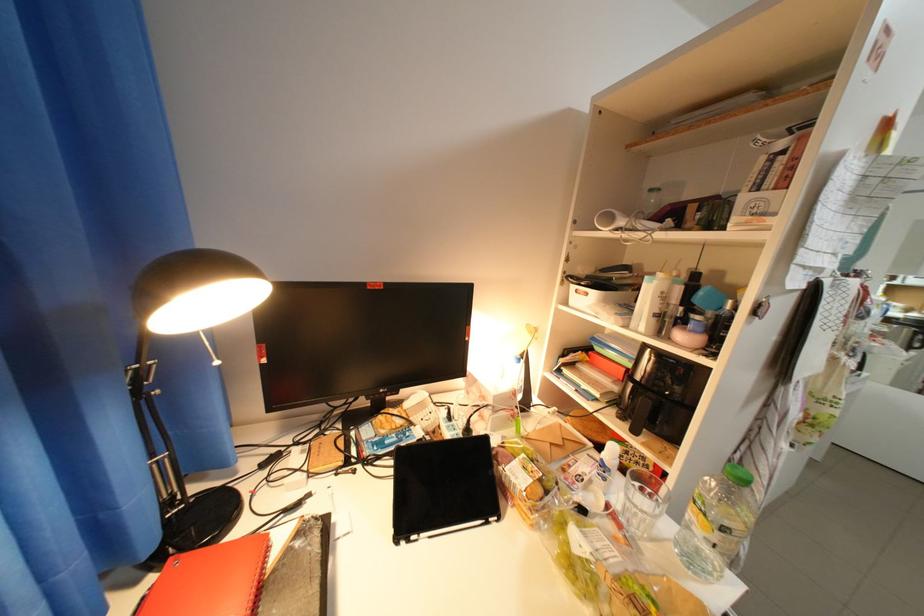
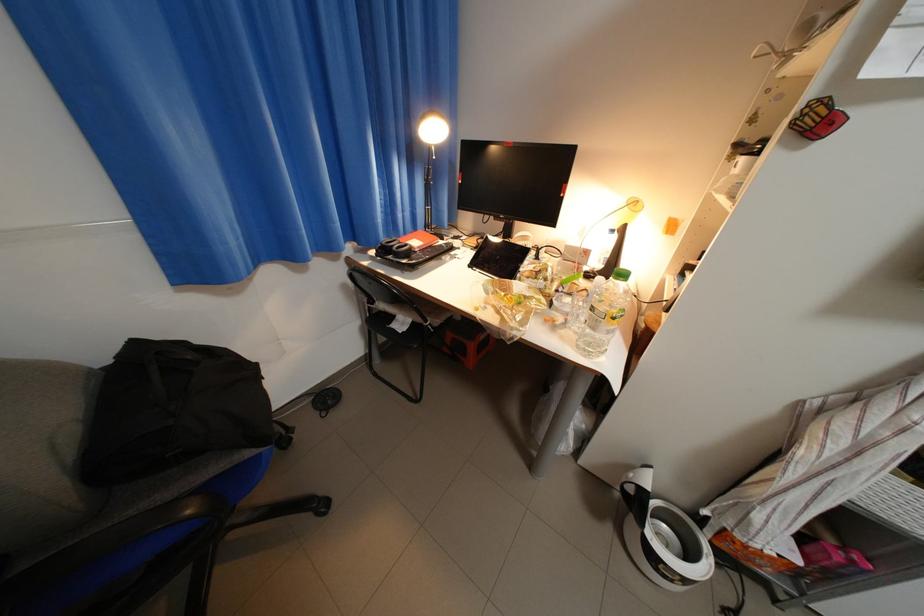
The point at (353,445) is marked in the first image. Where is the corresponding point in the second image?

(492, 241)